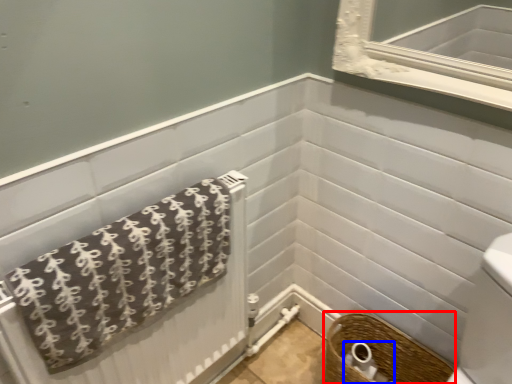
Question: Which object is further to the camera taking this photo, basket (highlighted by a red box) or toilet paper (highlighted by a blue box)?

Choices:
 (A) basket
 (B) toilet paper

Answer: (B)